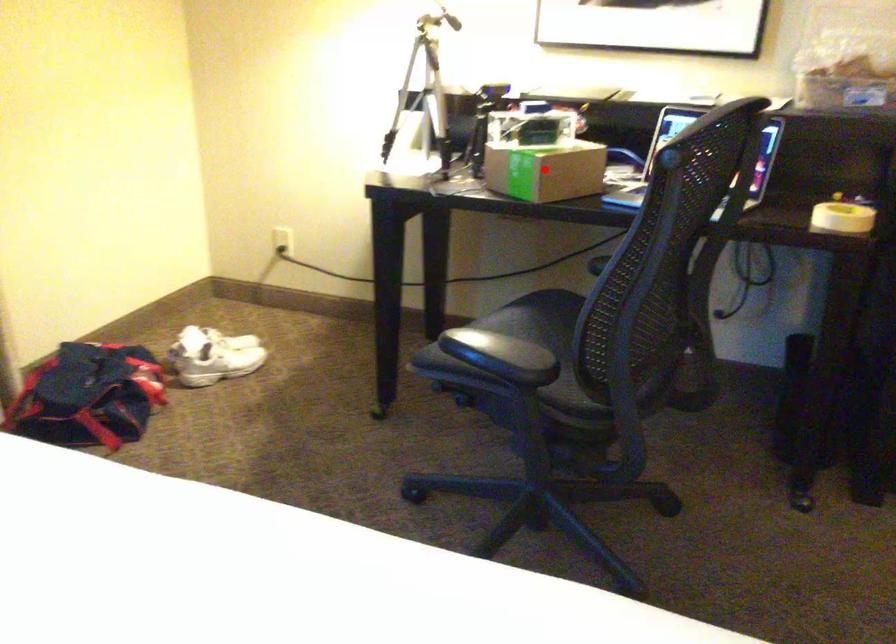
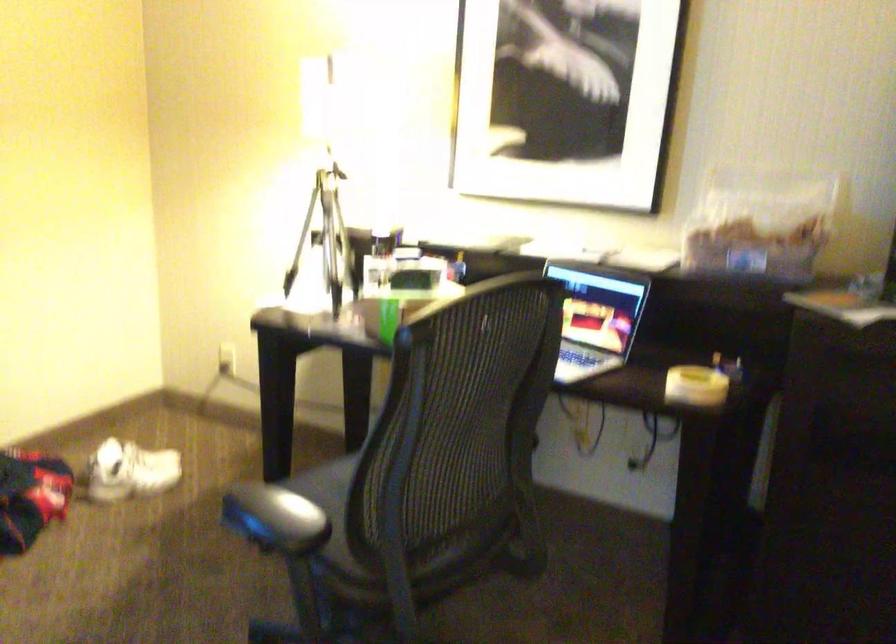
Question: I am providing you with two images of the same scene from different viewpoints. A red point is marked on the first image. Can you still see the location of the red point in image 2?

Choices:
 (A) Yes
 (B) No

Answer: (B)